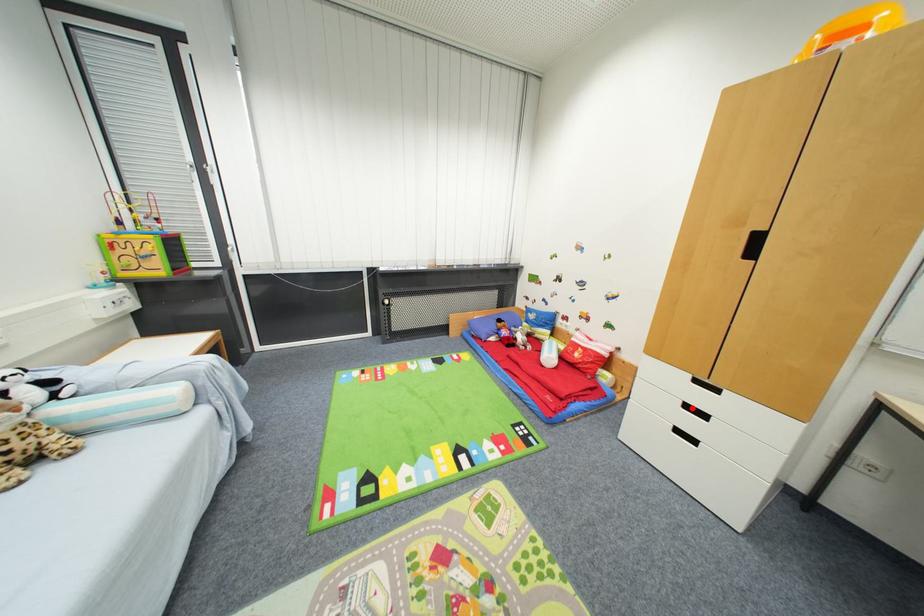
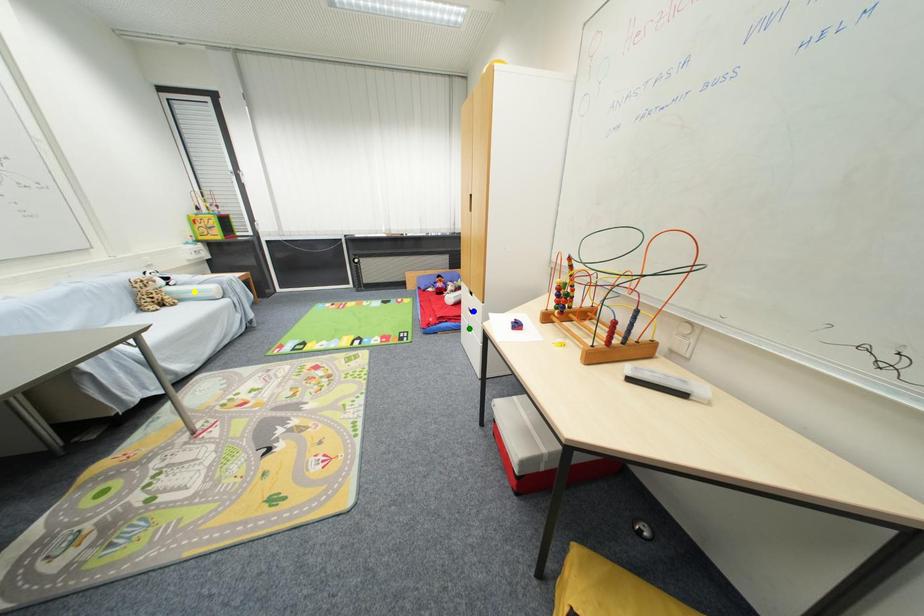
Question: I am providing you with two images of the same scene from different viewpoints. A red point is marked on the first image. You are given multiple points on the second image. Which point in image 2 is actually the same real-world point as the red point in image 1?

Choices:
 (A) green point
 (B) blue point
 (C) yellow point

Answer: (B)